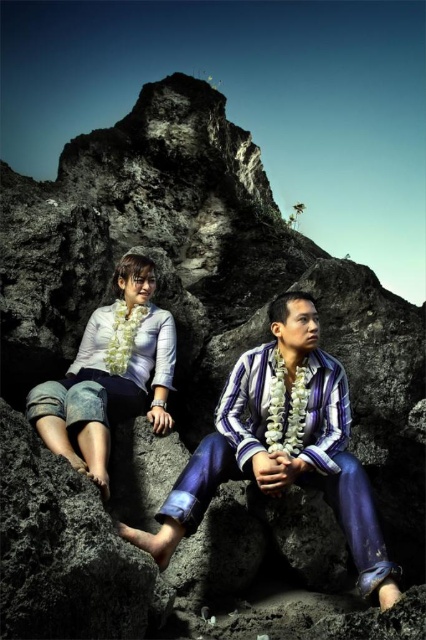
You are a photographer trying to capture a photo of the smooth rock at lower center and the denim shorts at left. Which object should you focus on first if you want to ensure both are in focus without adjusting the camera settings?

You should focus on the smooth rock at lower center first because it is closer to the viewer than the denim shorts at left, so focusing on the closer object will help both be in focus.

You are a fashion designer analyzing the clothing items in the image. Which clothing item, the striped cotton shirt at center or the denim shorts at left, has a greater width?

The striped cotton shirt at center has a greater width than the denim shorts at left.